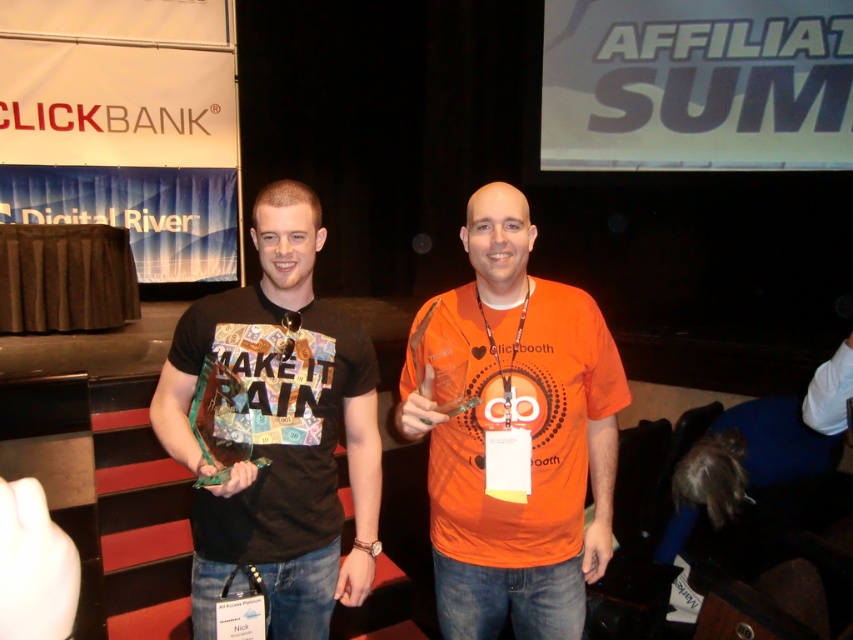
Question: Can you confirm if orange matte shirt at center is thinner than matte black t-shirt at center?

Choices:
 (A) no
 (B) yes

Answer: (A)

Question: Which point appears farthest from the camera in this image?

Choices:
 (A) coord(281,371)
 (B) coord(572,516)

Answer: (B)

Question: Which of the following is the farthest from the observer?

Choices:
 (A) matte black t-shirt at center
 (B) orange matte shirt at center

Answer: (B)

Question: Does orange matte shirt at center appear over matte black t-shirt at center?

Choices:
 (A) yes
 (B) no

Answer: (B)

Question: Is orange matte shirt at center positioned at the back of matte black t-shirt at center?

Choices:
 (A) yes
 (B) no

Answer: (A)